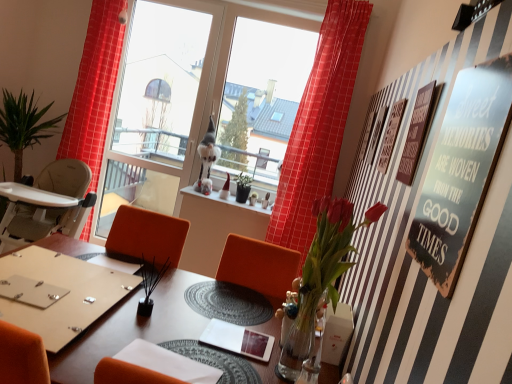
Question: In the image, is wooden plaque at upper right, which ranks as the second bulletin board in front-to-back order, positioned in front of or behind wooden table at center?

Choices:
 (A) front
 (B) behind

Answer: (B)

Question: From a real-world perspective, relative to wooden table at center, is wooden plaque at upper right, which is counted as the 1th bulletin board, starting from the back, vertically above or below?

Choices:
 (A) above
 (B) below

Answer: (A)

Question: Based on their relative distances, which object is nearer to the transparent glass window at center, which is counted as the first window screen, starting from the left?

Choices:
 (A) matte wooden table at center
 (B) wooden plaque at upper right, which ranks as the second bulletin board in front-to-back order
 (C) red checkered curtain at left, acting as the 2th curtain starting from the right
 (D) red sheer curtain at upper center, arranged as the second curtain when viewed from the left
 (E) translucent glass vase at center-right

Answer: (C)

Question: Considering the real-world distances, which object is farthest from the transparent glass window screen at center, which appears as the first window screen when viewed from the right?

Choices:
 (A) metallic silver sign at upper right, the 1th bulletin board positioned from the front
 (B) transparent glass window at center, which is counted as the first window screen, starting from the left
 (C) matte wooden table at center
 (D) wooden table at center
 (E) translucent glass vase at center-right

Answer: (A)